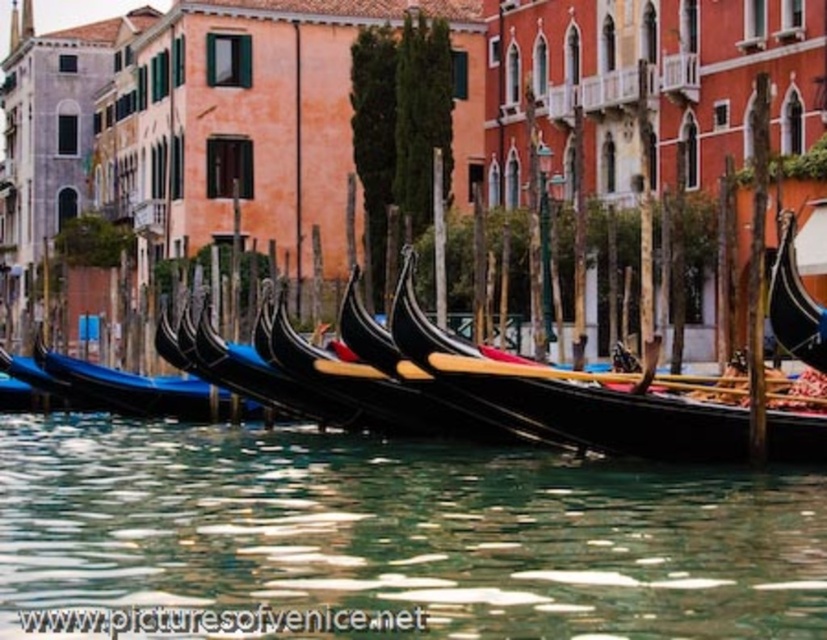
Question: Does black polished wood gondola at center appear over shiny black gondola at left?

Choices:
 (A) yes
 (B) no

Answer: (A)

Question: Is transparent glass water at center wider than shiny black gondola at left?

Choices:
 (A) yes
 (B) no

Answer: (A)

Question: Is transparent glass water at center bigger than shiny black gondola at left?

Choices:
 (A) yes
 (B) no

Answer: (A)

Question: Which is nearer to the shiny black gondola at left?

Choices:
 (A) transparent glass water at center
 (B) black polished wood gondola at center
 (C) shiny black gondola at center

Answer: (A)

Question: Which object appears farthest from the camera in this image?

Choices:
 (A) black polished wood gondola at center
 (B) transparent glass water at center

Answer: (A)

Question: Which is nearer to the transparent glass water at center?

Choices:
 (A) shiny black gondola at center
 (B) black polished wood gondola at center
 (C) shiny black gondola at left

Answer: (B)